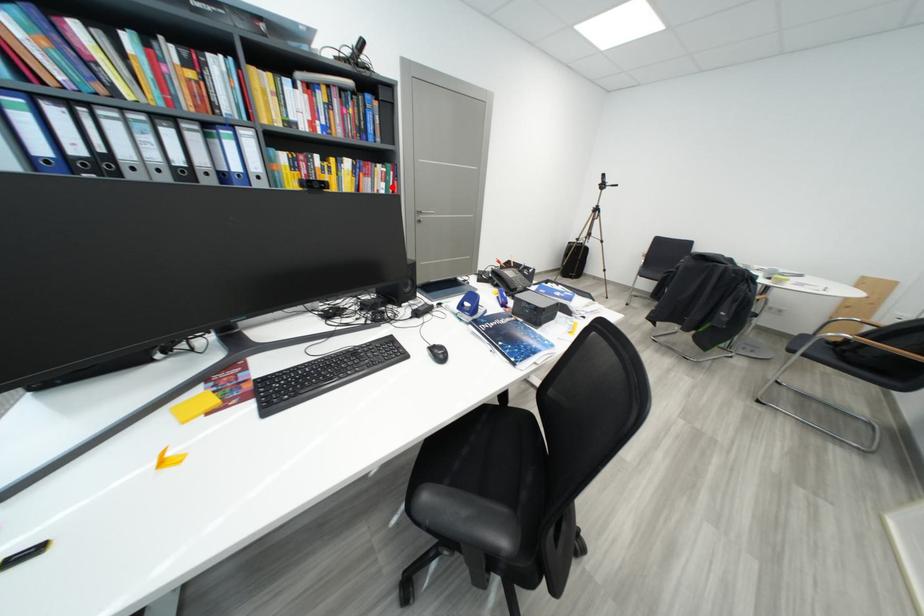
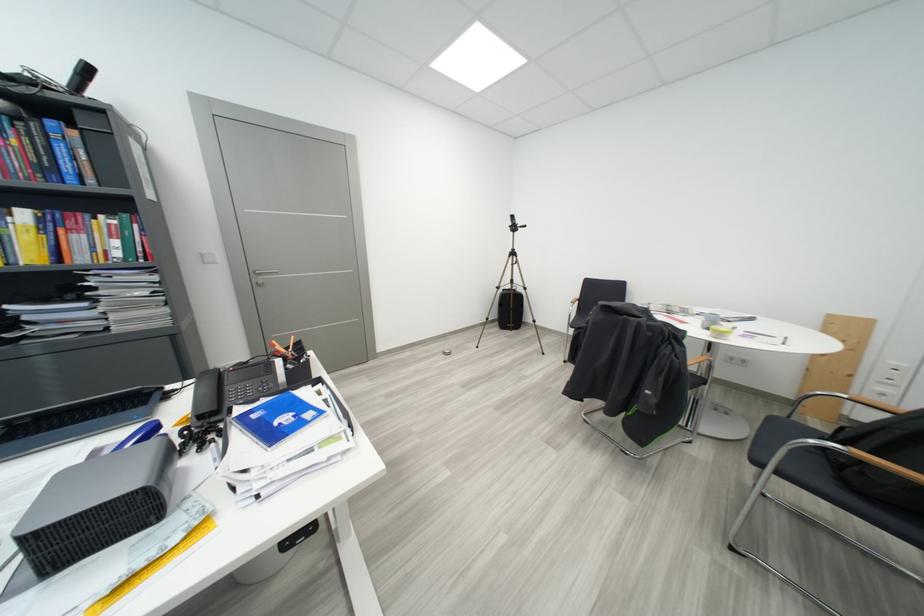
Locate, in the second image, the point that corresponds to the highlighted location in the first image.

(126, 245)